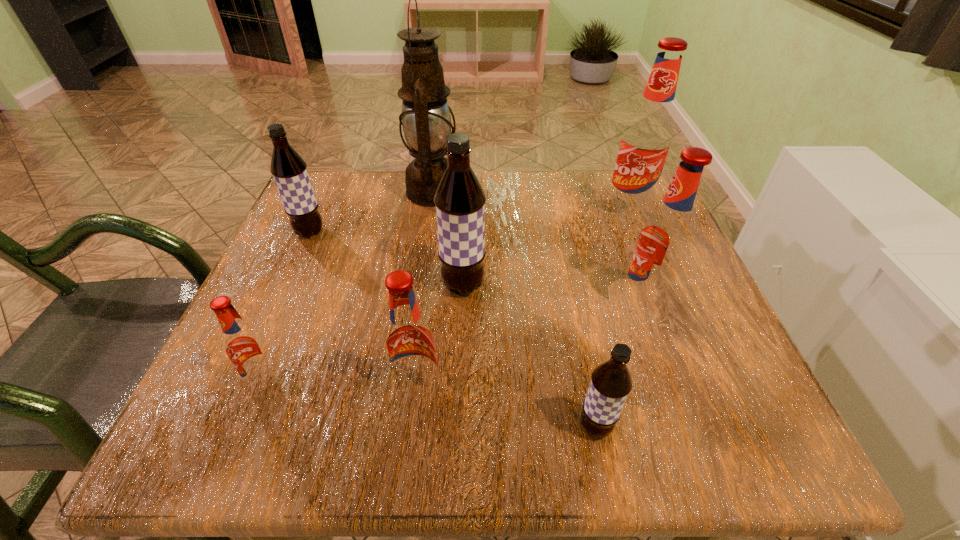
Locate an element on the screen. oil lamp at the far edge is located at coordinates (426, 120).

The width and height of the screenshot is (960, 540). Identify the location of object present at the far left corner. (289, 170).

This screenshot has height=540, width=960. What are the coordinates of `object present at the far right corner` in the screenshot? It's located at (647, 138).

Locate an element on the screen. The width and height of the screenshot is (960, 540). vacant region at the far edge is located at coordinates (489, 180).

In the image, there is a desktop. At what (x,y) coordinates should I click in order to perform the action: click on vacant space at the near edge. Please return your answer as a coordinate pair (x, y). The height and width of the screenshot is (540, 960). Looking at the image, I should click on (484, 455).

Locate an element on the screen. Image resolution: width=960 pixels, height=540 pixels. free space at the left edge of the desktop is located at coordinates (309, 352).

You are a GUI agent. You are given a task and a screenshot of the screen. Output one action in this format:
    pyautogui.click(x=<x>, y=<y>)
    Task: Click on the vacant region at the right edge of the desktop
    Image resolution: width=960 pixels, height=540 pixels.
    Given the screenshot: What is the action you would take?
    tap(685, 339)

In the image, there is a desktop. Where is `vacant area at the near left corner`? This screenshot has height=540, width=960. vacant area at the near left corner is located at coordinates (202, 454).

This screenshot has height=540, width=960. I want to click on free region at the far right corner of the desktop, so click(x=645, y=222).

You are a GUI agent. You are given a task and a screenshot of the screen. Output one action in this format:
    pyautogui.click(x=<x>, y=<y>)
    Task: Click on the empty location between the second red root beer from left to right and the second nearest brown root beer
    This screenshot has height=540, width=960.
    Given the screenshot: What is the action you would take?
    pyautogui.click(x=441, y=339)